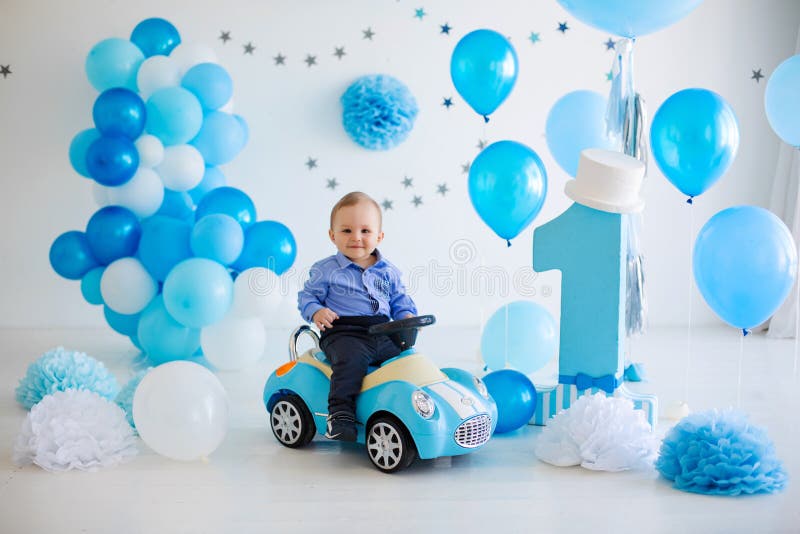
Image resolution: width=800 pixels, height=534 pixels. I want to click on floor, so [550, 511], [258, 509], [748, 384], [42, 331].